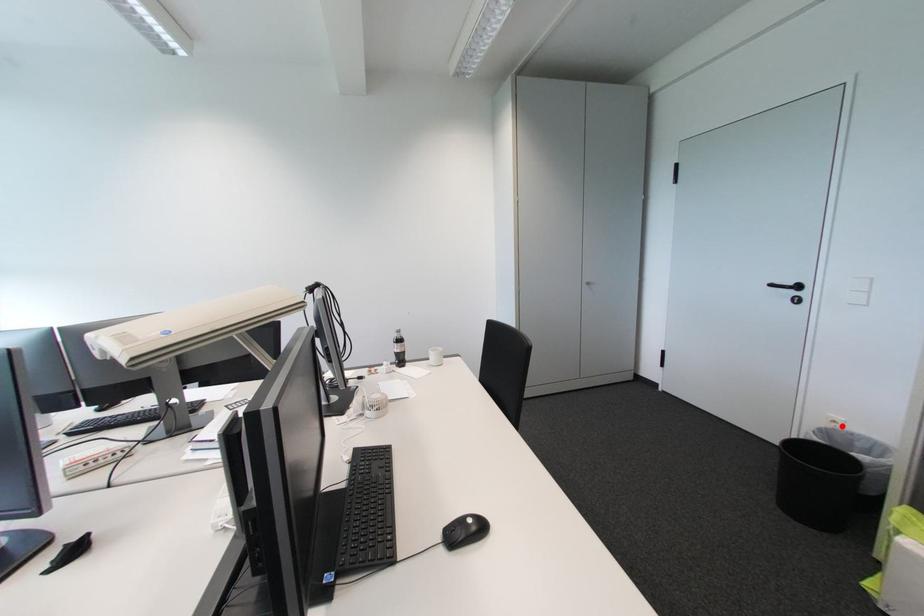
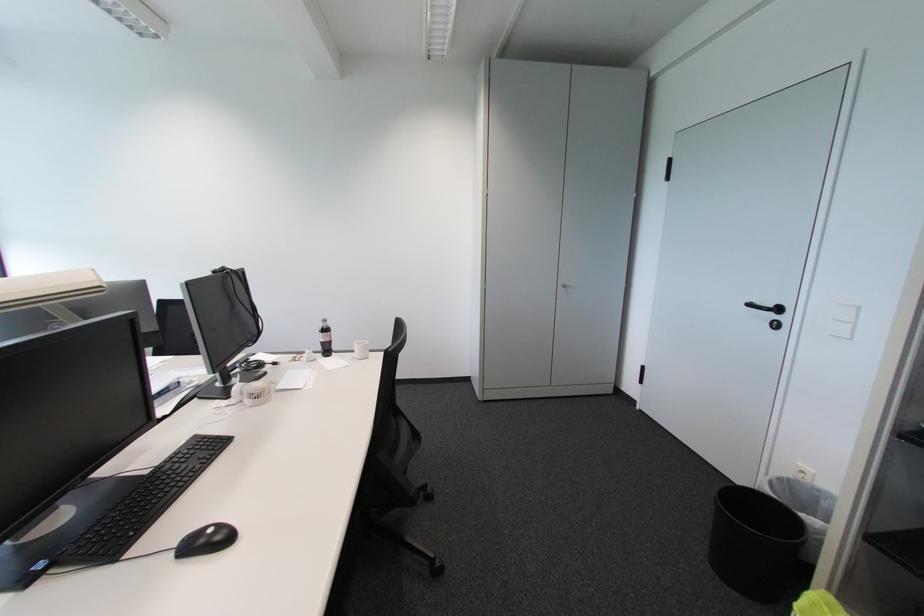
In the second image, find the point that corresponds to the highlighted location in the first image.

(809, 477)